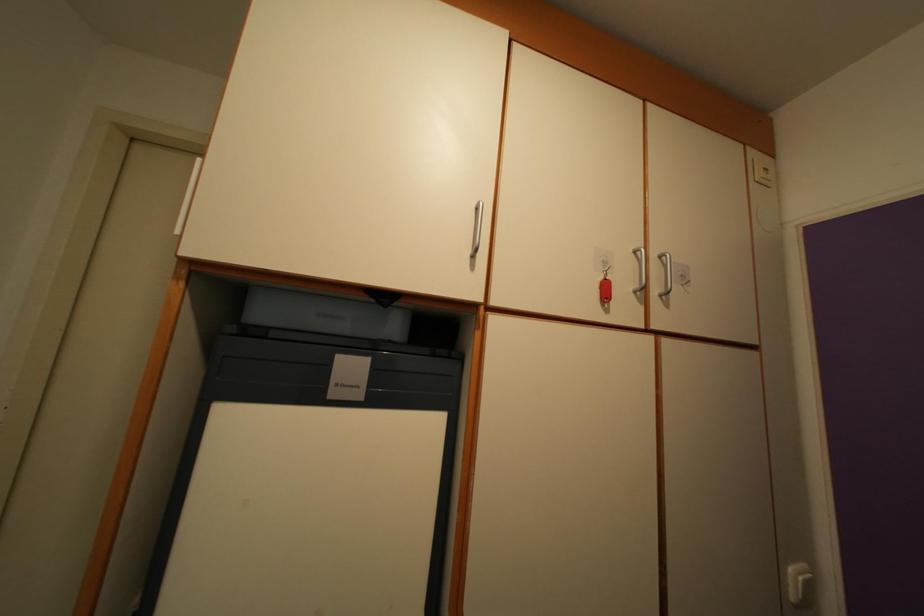
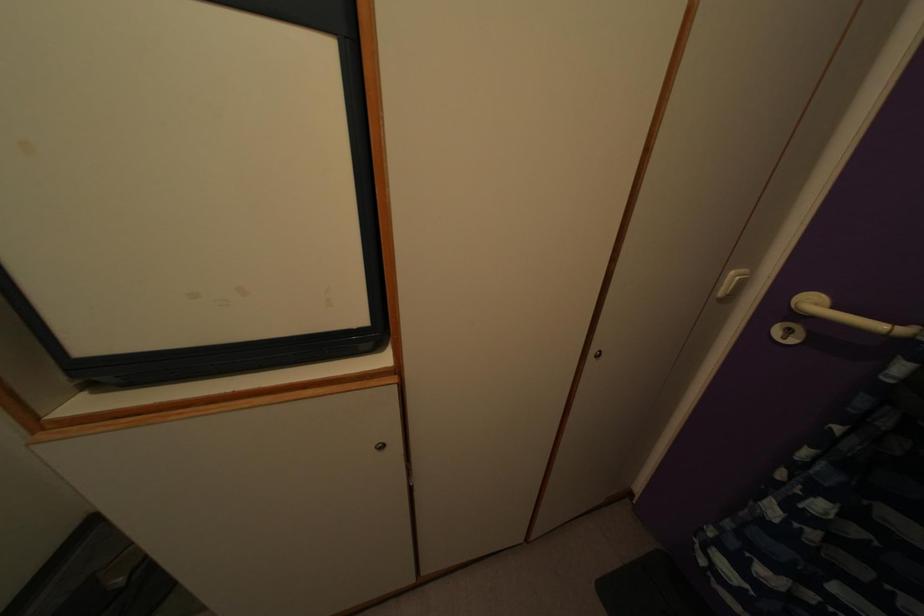
Where in the second image is the point corresponding to pixel 797 583 from the first image?

(736, 284)